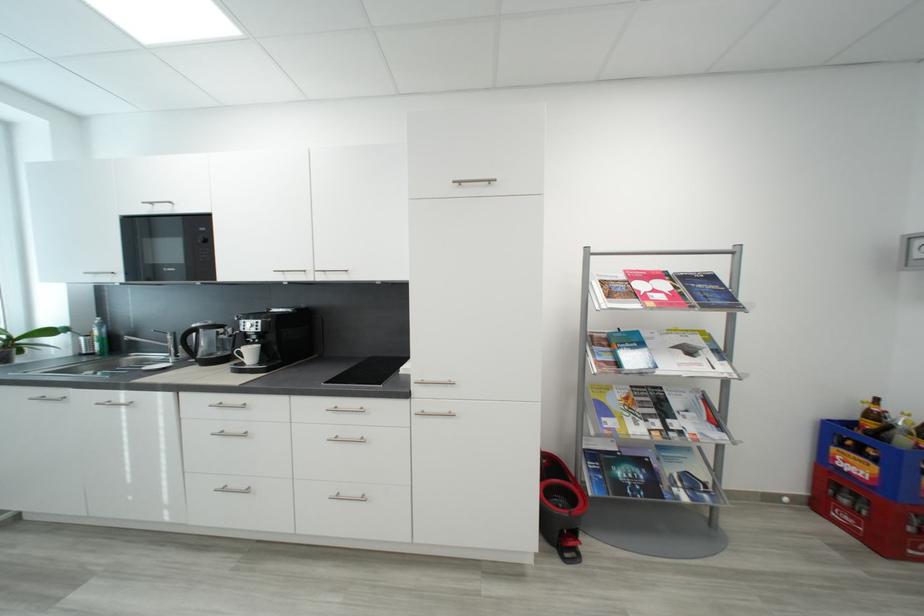
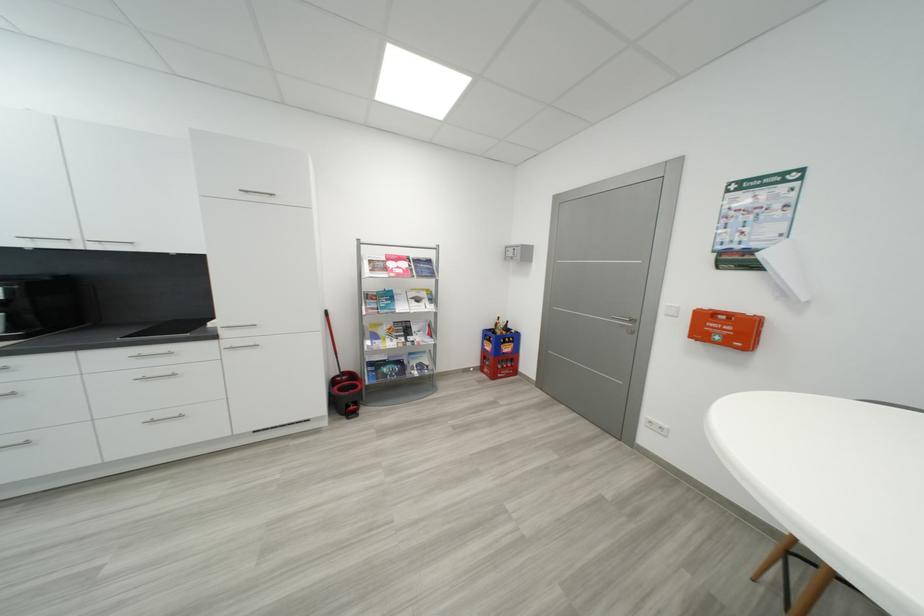
In the second image, find the point that corresponds to [454,381] in the first image.

(256, 325)